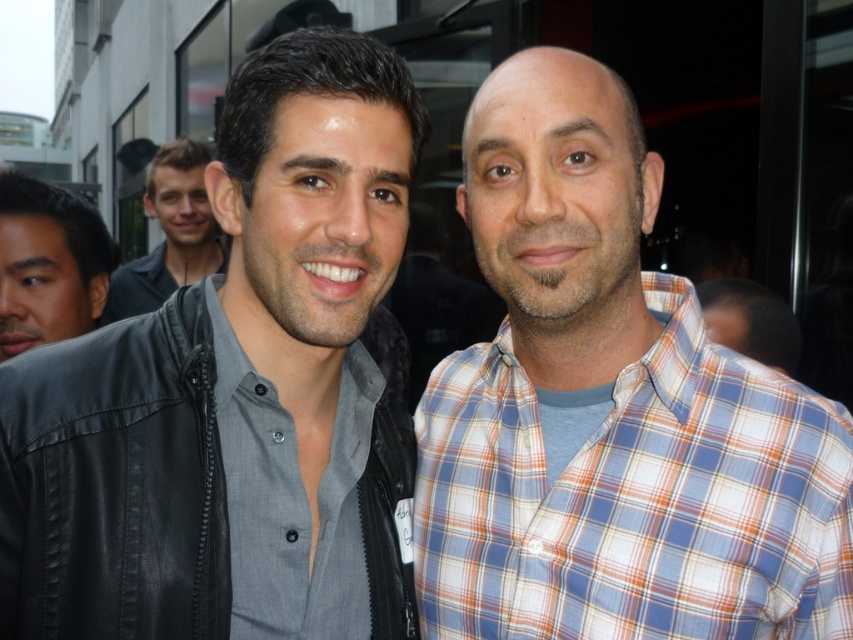
You are a photographer at an event and want to take a photo of the gray matte shirt at center and the plaid shirt at right. Which shirt should you focus on first if you want to capture the one closer to the camera?

The gray matte shirt at center is positioned on the left side of plaid shirt at right, so focusing on the gray matte shirt at center first would capture the one closer to the camera.

You are taking a photo of the two people in the scene. The matte black jacket at center is at point (236, 394). If you want to focus on the matte black jacket at center, where should you aim your camera?

You should aim your camera at point (236, 394) to focus on the matte black jacket at center.

In the scene shown: You are a photographer adjusting your camera to focus on two points in the image. The first point is labeled as point (x=318, y=97) and the second is point (x=71, y=260). Which point should you focus on first if you want to capture the closest object to the camera?

Point (x=318, y=97) is closer to the viewer than point (x=71, y=260), so you should focus on point (x=318, y=97) first to capture the closest object to the camera.